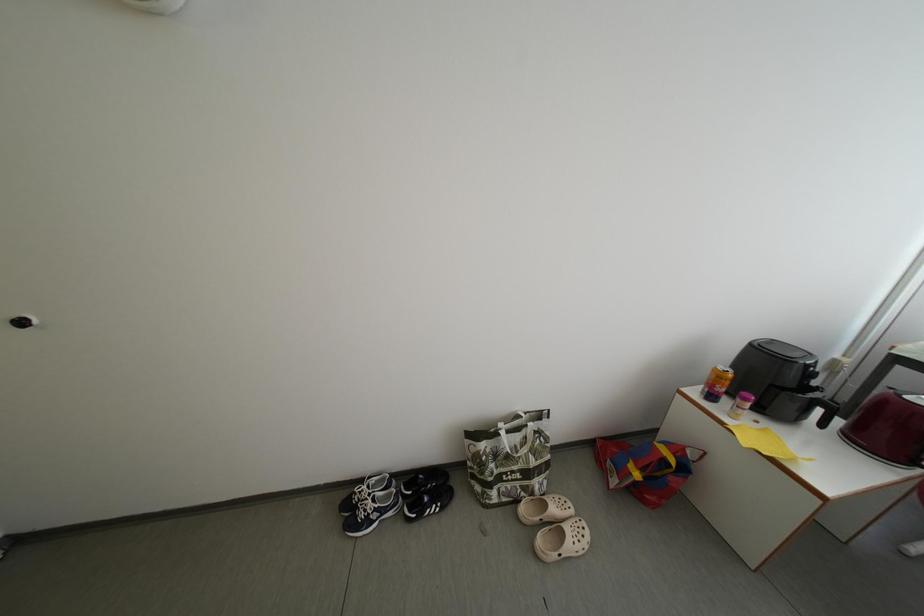
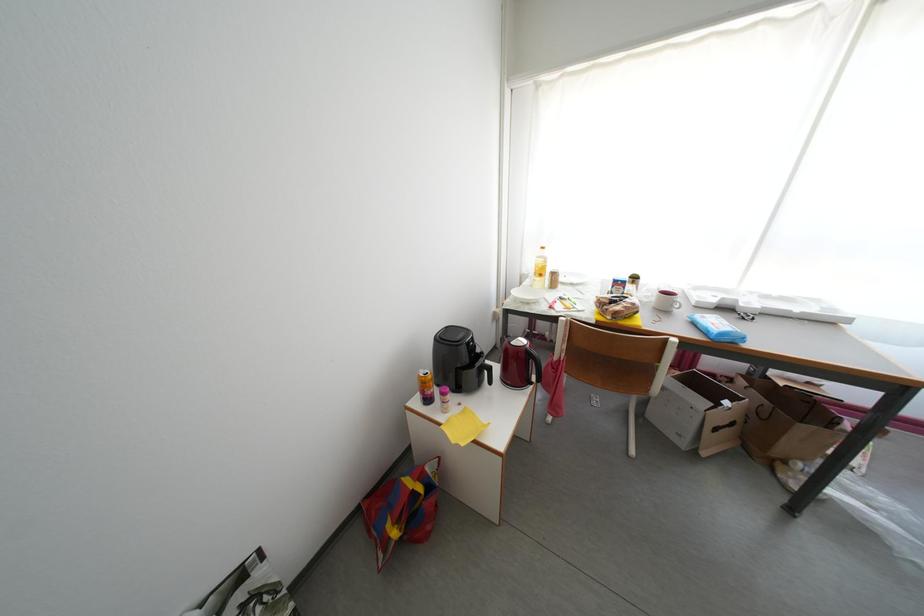
Question: The images are taken continuously from a first-person perspective. In which direction is your viewpoint rotating?

Choices:
 (A) Left
 (B) Right
 (C) Up
 (D) Down

Answer: (B)